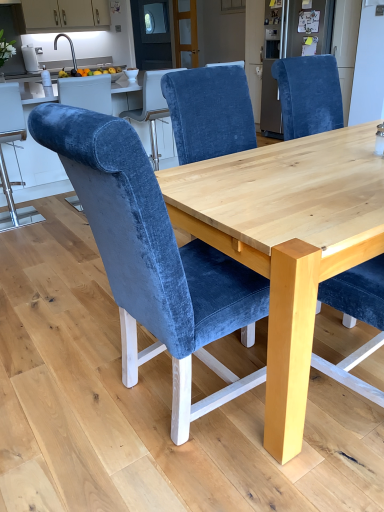
Identify the location of matte white cabinets at upper left. (65, 14).

Find the location of a particular element. velvet blue chair at center, the second chair positioned from the front is located at coordinates (210, 111).

What do you see at coordinates (210, 111) in the screenshot? This screenshot has height=512, width=384. I see `velvet blue chair at center, the 3th chair in the left-to-right sequence` at bounding box center [210, 111].

The height and width of the screenshot is (512, 384). What do you see at coordinates (152, 258) in the screenshot? I see `velvet blue chair at center, arranged as the second chair when viewed from the right` at bounding box center [152, 258].

What are the coordinates of `velvet blue chair at center, which is counted as the first chair, starting from the front` in the screenshot? It's located at (152, 258).

Locate an element on the screen. velvet blue chair at left, which is the 1th chair in back-to-front order is located at coordinates (10, 139).

This screenshot has width=384, height=512. Describe the element at coordinates (288, 243) in the screenshot. I see `natural wood table at center` at that location.

The width and height of the screenshot is (384, 512). I want to click on velvet blue chair at upper right, so click(x=340, y=39).

Identify the location of matte white cabinets at upper left. pyautogui.click(x=65, y=14).

From the image's perspective, is velvet blue chair at center, the second chair positioned from the front, positioned above or below velvet blue chair at upper right?

velvet blue chair at center, the second chair positioned from the front, is below velvet blue chair at upper right.

From a real-world perspective, is velvet blue chair at center, arranged as the 1th chair when viewed from the right, below velvet blue chair at upper right?

Yes, from a real-world perspective, velvet blue chair at center, arranged as the 1th chair when viewed from the right, is beneath velvet blue chair at upper right.

Locate an element on the screen. The height and width of the screenshot is (512, 384). the 1st chair to the left of the velvet blue chair at upper right, starting your count from the anchor is located at coordinates (x=210, y=111).

Are velvet blue chair at center, which is the 2th chair in back-to-front order, and velvet blue chair at upper right far apart?

Indeed, velvet blue chair at center, which is the 2th chair in back-to-front order, is not near velvet blue chair at upper right.

From their relative heights in the image, would you say velvet blue chair at center, which is counted as the first chair, starting from the front, is taller or shorter than matte white cabinets at upper left?

velvet blue chair at center, which is counted as the first chair, starting from the front, is taller than matte white cabinets at upper left.

From the image's perspective, which is below, velvet blue chair at center, which is the second chair in left-to-right order, or matte white cabinets at upper left?

velvet blue chair at center, which is the second chair in left-to-right order, from the image's perspective.

Considering the positions of objects velvet blue chair at center, which is counted as the first chair, starting from the front, and matte white cabinets at upper left in the image provided, who is more to the left, velvet blue chair at center, which is counted as the first chair, starting from the front, or matte white cabinets at upper left?

matte white cabinets at upper left is more to the left.

Would you say velvet blue chair at center, which is the second chair in left-to-right order, is outside matte white cabinets at upper left?

Yes, velvet blue chair at center, which is the second chair in left-to-right order, is outside of matte white cabinets at upper left.

From a real-world perspective, which object rests below the other?

velvet blue chair at left, acting as the third chair starting from the front, is physically lower.

Is velvet blue chair at left, which is the 1th chair in back-to-front order, taller than velvet blue chair at upper right?

No, velvet blue chair at left, which is the 1th chair in back-to-front order, is not taller than velvet blue chair at upper right.

Find the location of `appliance located on the right of velvet blue chair at left, which ranks as the 3th chair in right-to-left order`. appliance located on the right of velvet blue chair at left, which ranks as the 3th chair in right-to-left order is located at coordinates pyautogui.click(x=340, y=39).

Between velvet blue chair at left, which is the 1th chair in back-to-front order, and velvet blue chair at upper right, which one has larger width?

Wider between the two is velvet blue chair at upper right.

Which of these two, velvet blue chair at center, which is the second chair in left-to-right order, or velvet blue chair at center, the 3th chair in the left-to-right sequence, is wider?

velvet blue chair at center, the 3th chair in the left-to-right sequence, is wider.

Are velvet blue chair at center, which is counted as the first chair, starting from the front, and velvet blue chair at center, arranged as the 1th chair when viewed from the right, far apart?

That's not correct — velvet blue chair at center, which is counted as the first chair, starting from the front, is a little close to velvet blue chair at center, arranged as the 1th chair when viewed from the right.

Based on the photo, is velvet blue chair at center, which is counted as the first chair, starting from the front, located outside velvet blue chair at center, which is the 2th chair in back-to-front order?

Yes.

Which of these two, velvet blue chair at center, the third chair positioned from the back, or velvet blue chair at center, the 3th chair in the left-to-right sequence, stands taller?

Standing taller between the two is velvet blue chair at center, the 3th chair in the left-to-right sequence.

Is the surface of velvet blue chair at left, which is the 1th chair in back-to-front order, in direct contact with matte white cabinets at upper left?

There is a gap between velvet blue chair at left, which is the 1th chair in back-to-front order, and matte white cabinets at upper left.

Can you tell me how much velvet blue chair at left, which is the 1th chair in back-to-front order, and matte white cabinets at upper left differ in facing direction?

velvet blue chair at left, which is the 1th chair in back-to-front order, and matte white cabinets at upper left are facing 177 degrees away from each other.

From the image's perspective, which is below, velvet blue chair at left, which ranks as the 3th chair in right-to-left order, or matte white cabinets at upper left?

velvet blue chair at left, which ranks as the 3th chair in right-to-left order.

From a real-world perspective, which chair is the 3rd one underneath the matte white cabinets at upper left? Please provide its 2D coordinates.

[(10, 139)]

Locate an element on the screen. This screenshot has height=512, width=384. cabinetry above the velvet blue chair at center, which is the 2th chair in back-to-front order (from a real-world perspective) is located at coordinates click(x=65, y=14).

Which of these two, velvet blue chair at center, arranged as the 1th chair when viewed from the right, or matte white cabinets at upper left, is wider?

velvet blue chair at center, arranged as the 1th chair when viewed from the right, is wider.

Is velvet blue chair at center, the 3th chair in the left-to-right sequence, surrounding matte white cabinets at upper left?

Definitely not — matte white cabinets at upper left is not inside velvet blue chair at center, the 3th chair in the left-to-right sequence.

From a real-world perspective, does velvet blue chair at center, which is the 2th chair in back-to-front order, sit lower than matte white cabinets at upper left?

Yes.

In the scene shown: From a real-world perspective, who is located higher, velvet blue chair at upper right or matte white cabinets at upper left?

matte white cabinets at upper left is physically above.

Can you confirm if velvet blue chair at upper right is positioned to the left of matte white cabinets at upper left?

No, velvet blue chair at upper right is not to the left of matte white cabinets at upper left.

From a real-world perspective, count 1st chairs downward from the velvet blue chair at upper right and point to it. Please provide its 2D coordinates.

[(210, 111)]

Identify the location of cabinetry above the velvet blue chair at center, which is the second chair in left-to-right order (from a real-world perspective). This screenshot has width=384, height=512. (65, 14).

Considering their positions, is velvet blue chair at upper right positioned closer to natural wood table at center than velvet blue chair at left, acting as the third chair starting from the front?

velvet blue chair at left, acting as the third chair starting from the front.

Looking at the image, which one is located further to velvet blue chair at center, arranged as the second chair when viewed from the right, matte white cabinets at upper left or velvet blue chair at upper right?

matte white cabinets at upper left lies further to velvet blue chair at center, arranged as the second chair when viewed from the right, than the other object.

Estimate the real-world distances between objects in this image. Which object is further from natural wood table at center, velvet blue chair at left, which ranks as the 3th chair in right-to-left order, or velvet blue chair at upper right?

velvet blue chair at upper right is positioned further to the anchor natural wood table at center.

From the image, which object appears to be nearer to velvet blue chair at center, arranged as the second chair when viewed from the right, velvet blue chair at center, the 3th chair in the left-to-right sequence, or velvet blue chair at upper right?

velvet blue chair at center, the 3th chair in the left-to-right sequence, is closer to velvet blue chair at center, arranged as the second chair when viewed from the right.

Based on their spatial positions, is velvet blue chair at center, the second chair positioned from the front, or velvet blue chair at center, which is counted as the first chair, starting from the front, closer to matte white cabinets at upper left?

Based on the image, velvet blue chair at center, the second chair positioned from the front, appears to be nearer to matte white cabinets at upper left.

Based on their spatial positions, is velvet blue chair at upper right or velvet blue chair at center, the third chair positioned from the back, further from velvet blue chair at left, acting as the third chair starting from the front?

velvet blue chair at upper right lies further to velvet blue chair at left, acting as the third chair starting from the front, than the other object.

Estimate the real-world distances between objects in this image. Which object is closer to velvet blue chair at center, the second chair positioned from the front, velvet blue chair at center, which is counted as the first chair, starting from the front, or natural wood table at center?

The object closer to velvet blue chair at center, the second chair positioned from the front, is natural wood table at center.

When comparing their distances from matte white cabinets at upper left, does natural wood table at center or velvet blue chair at upper right seem further?

natural wood table at center is further to matte white cabinets at upper left.

This screenshot has height=512, width=384. In order to click on appliance positioned between velvet blue chair at center, which is the second chair in left-to-right order, and matte white cabinets at upper left from near to far in this screenshot , I will do `click(340, 39)`.

This screenshot has width=384, height=512. Find the location of `chair between velvet blue chair at center, the 3th chair in the left-to-right sequence, and matte white cabinets at upper left from front to back`. chair between velvet blue chair at center, the 3th chair in the left-to-right sequence, and matte white cabinets at upper left from front to back is located at coordinates (10, 139).

This screenshot has width=384, height=512. In order to click on round table between velvet blue chair at center, which is the second chair in left-to-right order, and matte white cabinets at upper left from front to back in this screenshot , I will do `click(288, 243)`.

Locate an element on the screen. The height and width of the screenshot is (512, 384). appliance positioned between natural wood table at center and matte white cabinets at upper left from near to far is located at coordinates (340, 39).